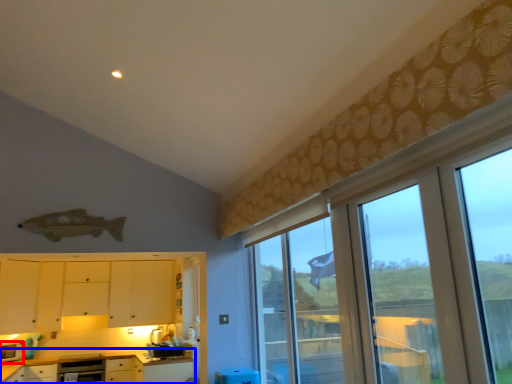
Question: Which object appears farthest to the camera in this image, appliance (highlighted by a red box) or cabinetry (highlighted by a blue box)?

Choices:
 (A) appliance
 (B) cabinetry

Answer: (A)